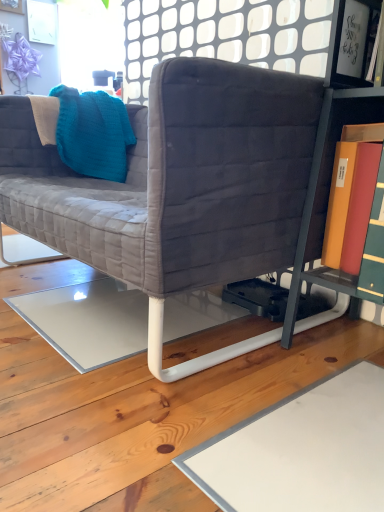
Question: Can you confirm if velvet gray couch at center is bigger than teal knitted throw pillow at upper left?

Choices:
 (A) no
 (B) yes

Answer: (B)

Question: Is velvet gray couch at center behind teal knitted throw pillow at upper left?

Choices:
 (A) yes
 (B) no

Answer: (B)

Question: Is velvet gray couch at center closer to the viewer compared to teal knitted throw pillow at upper left?

Choices:
 (A) no
 (B) yes

Answer: (B)

Question: Is velvet gray couch at center turned away from teal knitted throw pillow at upper left?

Choices:
 (A) yes
 (B) no

Answer: (B)

Question: From a real-world perspective, is velvet gray couch at center physically below teal knitted throw pillow at upper left?

Choices:
 (A) yes
 (B) no

Answer: (A)

Question: Considering the positions of white glossy frame at upper right and teal knitted throw pillow at upper left in the image, is white glossy frame at upper right bigger or smaller than teal knitted throw pillow at upper left?

Choices:
 (A) small
 (B) big

Answer: (A)

Question: In the image, is white glossy frame at upper right on the left side or the right side of teal knitted throw pillow at upper left?

Choices:
 (A) left
 (B) right

Answer: (B)

Question: In terms of width, does white glossy frame at upper right look wider or thinner when compared to teal knitted throw pillow at upper left?

Choices:
 (A) wide
 (B) thin

Answer: (B)

Question: Does point (357, 86) appear closer or farther from the camera than point (104, 138)?

Choices:
 (A) farther
 (B) closer

Answer: (B)

Question: Considering the positions of point (332, 72) and point (195, 117), is point (332, 72) closer or farther from the camera than point (195, 117)?

Choices:
 (A) farther
 (B) closer

Answer: (A)

Question: From the image's perspective, is white glossy frame at upper right above or below velvet gray couch at center?

Choices:
 (A) below
 (B) above

Answer: (B)

Question: In the image, is white glossy frame at upper right on the left side or the right side of velvet gray couch at center?

Choices:
 (A) left
 (B) right

Answer: (B)

Question: In the image, is white glossy frame at upper right positioned in front of or behind velvet gray couch at center?

Choices:
 (A) front
 (B) behind

Answer: (B)

Question: From the image's perspective, relative to white glossy frame at upper right, is velvet gray couch at center above or below?

Choices:
 (A) above
 (B) below

Answer: (B)

Question: Considering the positions of velvet gray couch at center and white glossy frame at upper right in the image, is velvet gray couch at center bigger or smaller than white glossy frame at upper right?

Choices:
 (A) small
 (B) big

Answer: (B)